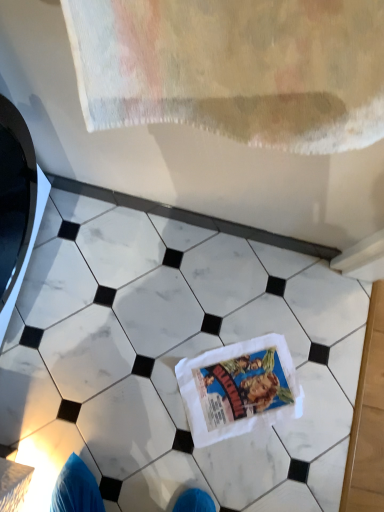
Locate an element on the screen. Image resolution: width=384 pixels, height=512 pixels. vacant space to the left of white cotton comic book at center is located at coordinates (156, 357).